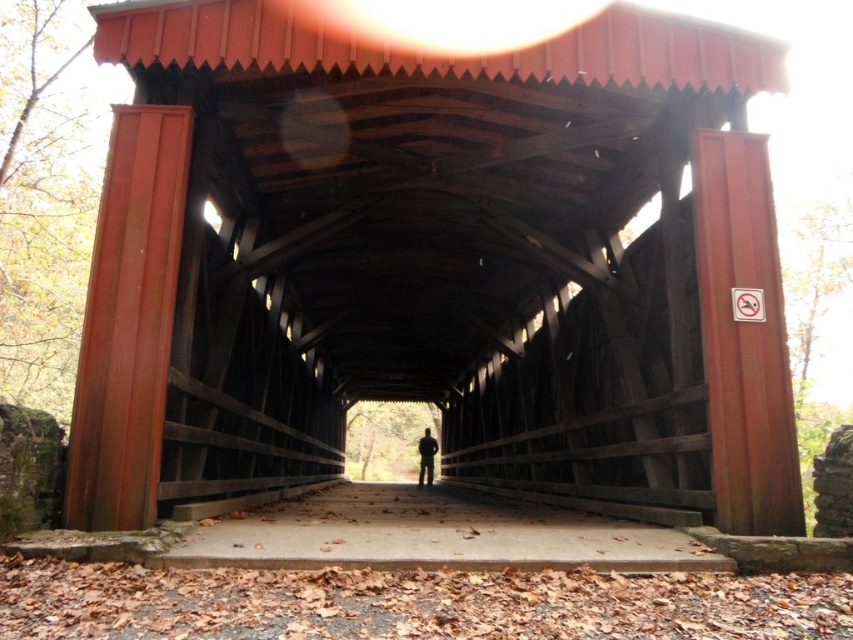
You are standing at the entrance of the covered bridge and want to walk straight ahead toward the center. Based on the coordinates provided, will you reach the matte wood bridge at center before reaching the back wall of the bridge?

The matte wood bridge at center is located at coordinates point (434, 264), which is positioned in the central area of the bridge. Since you are starting from the entrance and walking straight toward the center, you will reach the matte wood bridge at center before reaching the back wall of the bridge.

You are a painter standing in the covered bridge and want to paint both the matte wood bridge at center and the silhouette fabric at center. Which object should you focus on first if you want to paint the larger one first?

The matte wood bridge at center is bigger than the silhouette fabric at center, so you should focus on painting the matte wood bridge at center first.

You are a painter standing in the covered bridge and want to place a 1.2 meter wide canvas on the floor. The matte wood bridge at center and silhouette fabric at center are both in your way. Which object should you move to make space for the canvas?

The matte wood bridge at center is wider than the silhouette fabric at center, so you should move the silhouette fabric at center to make space for the 1.2 meter wide canvas.